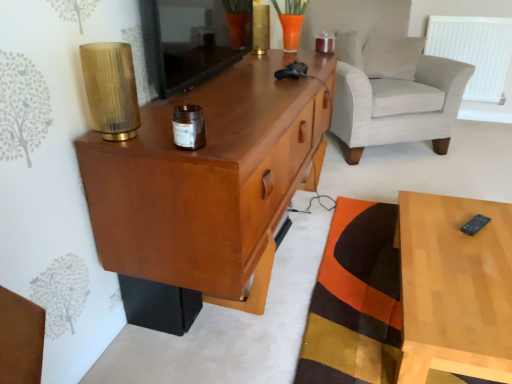
Question: From a real-world perspective, is light brown wood at right beneath white textured pillow at upper right?

Choices:
 (A) yes
 (B) no

Answer: (A)

Question: Is light brown wood at right bigger than white textured pillow at upper right?

Choices:
 (A) no
 (B) yes

Answer: (B)

Question: Can you confirm if light brown wood at right is positioned to the left of white textured pillow at upper right?

Choices:
 (A) no
 (B) yes

Answer: (B)

Question: Is light brown wood at right located outside white textured pillow at upper right?

Choices:
 (A) no
 (B) yes

Answer: (B)

Question: Is light brown wood at right to the right of white textured pillow at upper right from the viewer's perspective?

Choices:
 (A) yes
 (B) no

Answer: (B)

Question: Does light brown wood at right lie in front of white textured pillow at upper right?

Choices:
 (A) no
 (B) yes

Answer: (B)

Question: Is white plastic radiator at upper right in front of white textured pillow at upper right?

Choices:
 (A) yes
 (B) no

Answer: (B)

Question: Can you confirm if white plastic radiator at upper right is thinner than white textured pillow at upper right?

Choices:
 (A) no
 (B) yes

Answer: (B)

Question: Can we say white plastic radiator at upper right lies outside white textured pillow at upper right?

Choices:
 (A) no
 (B) yes

Answer: (B)

Question: Is white plastic radiator at upper right not near white textured pillow at upper right?

Choices:
 (A) no
 (B) yes

Answer: (A)

Question: Can you confirm if white plastic radiator at upper right is shorter than white textured pillow at upper right?

Choices:
 (A) no
 (B) yes

Answer: (A)

Question: Is white plastic radiator at upper right oriented towards white textured pillow at upper right?

Choices:
 (A) no
 (B) yes

Answer: (A)

Question: From the image's perspective, would you say white plastic radiator at upper right is shown under white striped fabric armchair at upper right?

Choices:
 (A) yes
 (B) no

Answer: (B)